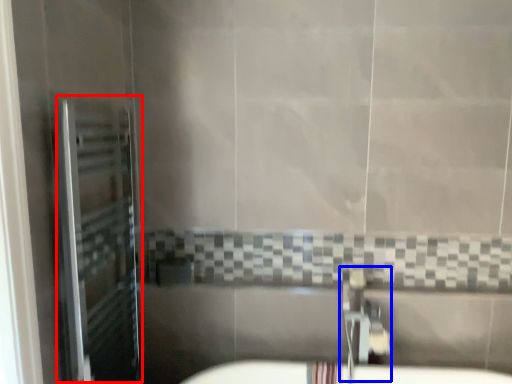
Question: Which point is further to the camera, screen door (highlighted by a red box) or plumbing fixture (highlighted by a blue box)?

Choices:
 (A) screen door
 (B) plumbing fixture

Answer: (B)